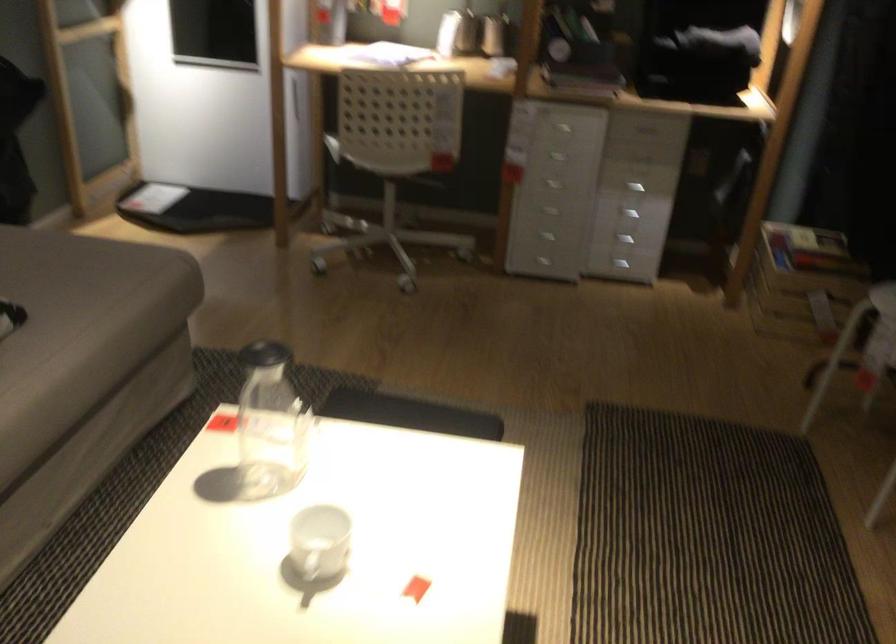
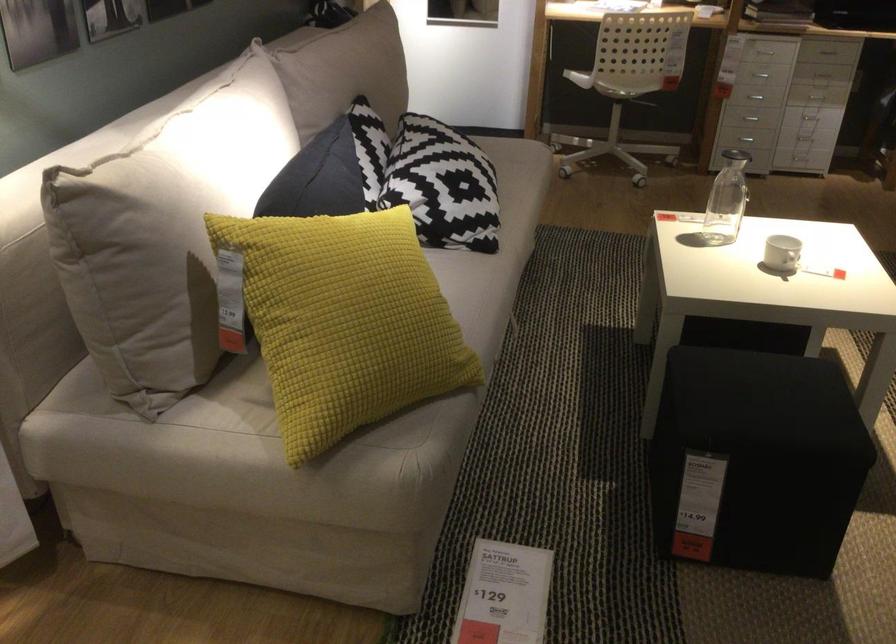
Find the pixel in the second image that matches [532,204] in the first image.

(755, 97)